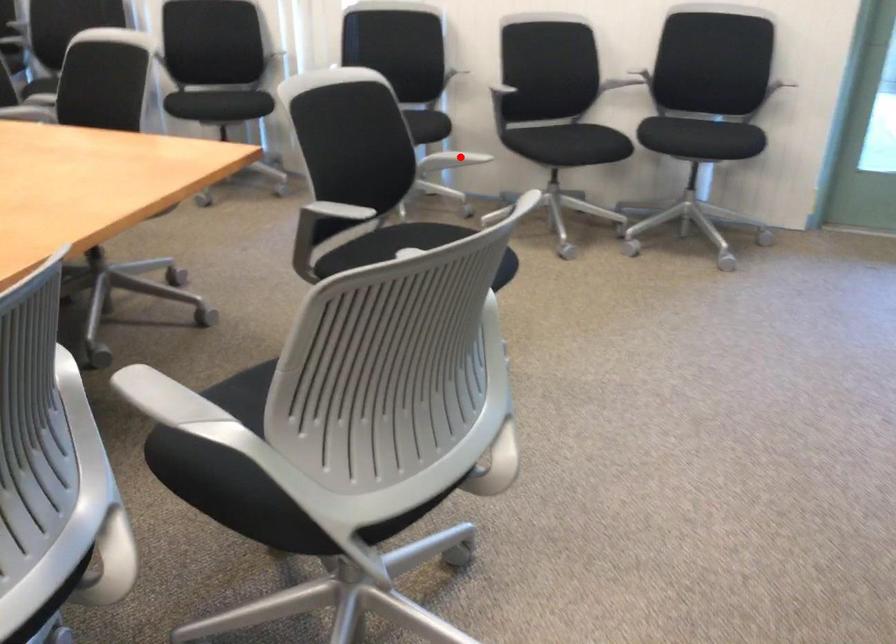
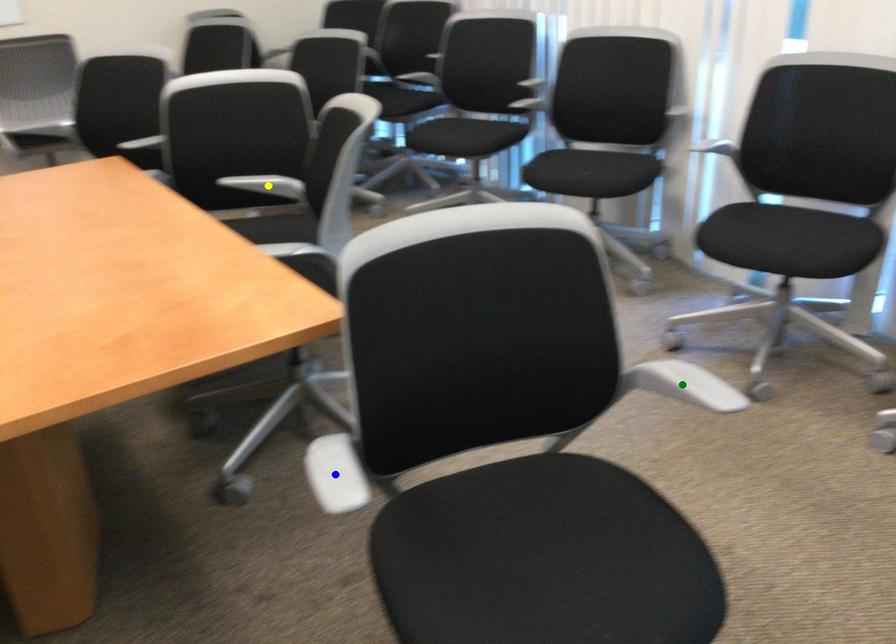
Question: I am providing you with two images of the same scene from different viewpoints. A red point is marked on the first image. You are given multiple points on the second image. Can you choose the point in image 2 that corresponds to the point in image 1?

Choices:
 (A) yellow point
 (B) green point
 (C) blue point

Answer: (B)